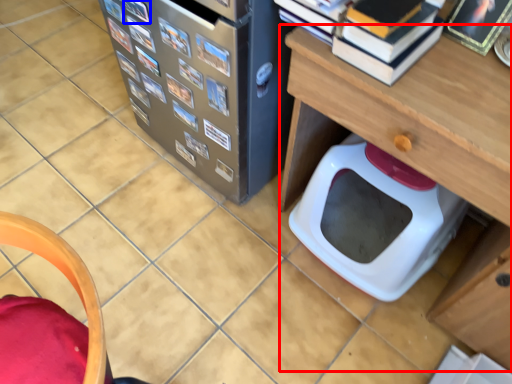
Question: Among these objects, which one is nearest to the camera, table (highlighted by a red box) or book (highlighted by a blue box)?

Choices:
 (A) table
 (B) book

Answer: (A)